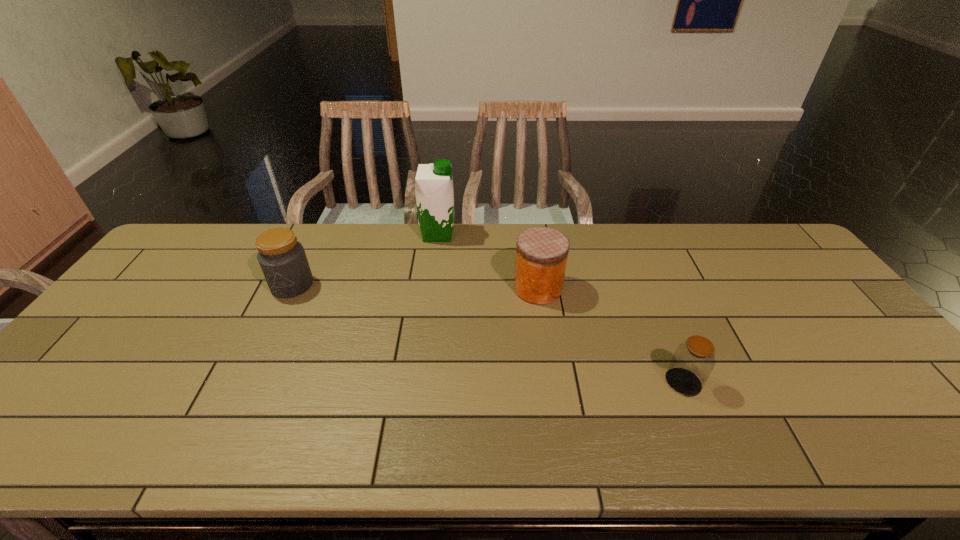
This screenshot has height=540, width=960. I want to click on object that is at the far edge, so click(434, 191).

You are a GUI agent. You are given a task and a screenshot of the screen. Output one action in this format:
    pyautogui.click(x=<x>, y=<y>)
    Task: Click on the free space at the far edge
    
    Given the screenshot: What is the action you would take?
    pyautogui.click(x=313, y=224)

The height and width of the screenshot is (540, 960). What are the coordinates of `vacant space at the near edge of the desktop` in the screenshot? It's located at (801, 427).

In the image, there is a desktop. At what (x,y) coordinates should I click in order to perform the action: click on free space at the right edge. Please return your answer as a coordinate pair (x, y). This screenshot has height=540, width=960. Looking at the image, I should click on (830, 306).

The image size is (960, 540). I want to click on free space at the near left corner of the desktop, so click(26, 440).

Locate an element on the screen. The height and width of the screenshot is (540, 960). unoccupied position between the second jar from right to left and the leftmost jar is located at coordinates (415, 287).

This screenshot has height=540, width=960. In order to click on unoccupied position between the shortest jar and the third object from left to right in this screenshot , I will do `click(611, 335)`.

Where is `empty space between the leftmost object and the second jar from right to left`? Image resolution: width=960 pixels, height=540 pixels. empty space between the leftmost object and the second jar from right to left is located at coordinates (415, 287).

Where is `free space that is in between the leftmost jar and the tallest object`? The width and height of the screenshot is (960, 540). free space that is in between the leftmost jar and the tallest object is located at coordinates (365, 260).

Where is `free space between the leftmost object and the shortest jar`? free space between the leftmost object and the shortest jar is located at coordinates (488, 334).